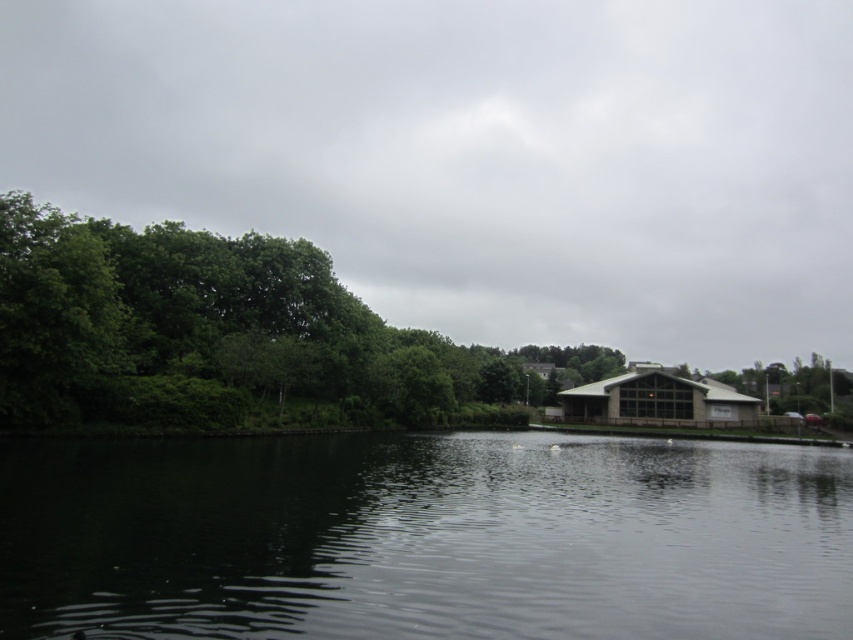
You are standing at the edge of the water and want to take a photo that includes both the dark reflective water at center and the green leafy trees at left. Which object should you frame first to ensure both are visible in the photo?

The dark reflective water at center is smaller than the green leafy trees at left, so you should frame the dark reflective water at center first since it takes up less space and can be positioned within the frame while still allowing room for the larger green leafy trees at left.

In the scene shown: You are standing at the edge of the water and want to take a photo of the green leafy trees at left and the dark reflective water at center. Which object will appear closer to the bottom of your photo?

The dark reflective water at center will appear closer to the bottom of your photo because it is located below the green leafy trees at left.

You are standing at the edge of the scene and want to walk towards the green leafy trees at left. Which direction should you walk to avoid stepping on the dark reflective water at center?

You should walk to the right side of the green leafy trees at left to avoid stepping on the dark reflective water at center, as the dark reflective water at center is positioned on the left side of the green leafy trees at left.